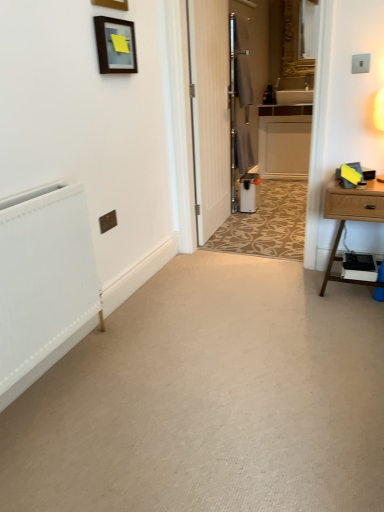
Question: From the image's perspective, does matte black picture frame at upper left, which ranks as the 2th picture frame in top-to-bottom order, appear higher than gold ornate mirror at upper center?

Choices:
 (A) no
 (B) yes

Answer: (A)

Question: Is matte black picture frame at upper left, which ranks as the 2th picture frame in top-to-bottom order, facing towards gold ornate mirror at upper center?

Choices:
 (A) no
 (B) yes

Answer: (A)

Question: Does matte black picture frame at upper left, the 1th picture frame from the bottom, appear on the right side of gold ornate mirror at upper center?

Choices:
 (A) no
 (B) yes

Answer: (A)

Question: Does matte black picture frame at upper left, which ranks as the 2th picture frame in top-to-bottom order, have a greater width compared to gold ornate mirror at upper center?

Choices:
 (A) yes
 (B) no

Answer: (B)

Question: Considering the relative positions of matte black picture frame at upper left, the 1th picture frame from the bottom, and gold ornate mirror at upper center in the image provided, is matte black picture frame at upper left, the 1th picture frame from the bottom, in front of gold ornate mirror at upper center?

Choices:
 (A) yes
 (B) no

Answer: (A)

Question: Relative to white plastic air purifier at center, is gold ornate mirror at upper center in front or behind?

Choices:
 (A) front
 (B) behind

Answer: (B)

Question: From a real-world perspective, is gold ornate mirror at upper center positioned above or below white plastic air purifier at center?

Choices:
 (A) below
 (B) above

Answer: (B)

Question: In terms of height, does gold ornate mirror at upper center look taller or shorter compared to white plastic air purifier at center?

Choices:
 (A) tall
 (B) short

Answer: (A)

Question: Choose the correct answer: Is gold ornate mirror at upper center inside white plastic air purifier at center or outside it?

Choices:
 (A) outside
 (B) inside

Answer: (A)

Question: Considering the positions of point pos(122,10) and point pos(119,62), is point pos(122,10) closer or farther from the camera than point pos(119,62)?

Choices:
 (A) closer
 (B) farther

Answer: (A)

Question: Considering the positions of matte wooden picture frame at upper center, which is the 1th picture frame from top to bottom, and matte black picture frame at upper left, the 1th picture frame from the bottom, in the image, is matte wooden picture frame at upper center, which is the 1th picture frame from top to bottom, bigger or smaller than matte black picture frame at upper left, the 1th picture frame from the bottom,?

Choices:
 (A) small
 (B) big

Answer: (A)

Question: In terms of width, does matte wooden picture frame at upper center, which is the 1th picture frame from top to bottom, look wider or thinner when compared to matte black picture frame at upper left, the 1th picture frame from the bottom?

Choices:
 (A) wide
 (B) thin

Answer: (B)

Question: Do you think matte wooden picture frame at upper center, placed as the second picture frame when sorted from bottom to top, is within matte black picture frame at upper left, the 1th picture frame from the bottom, or outside of it?

Choices:
 (A) inside
 (B) outside

Answer: (B)

Question: Is matte black picture frame at upper left, the 1th picture frame from the bottom, taller or shorter than white wood cabinet at center?

Choices:
 (A) short
 (B) tall

Answer: (A)

Question: Is point (109, 60) positioned closer to the camera than point (263, 126)?

Choices:
 (A) farther
 (B) closer

Answer: (B)